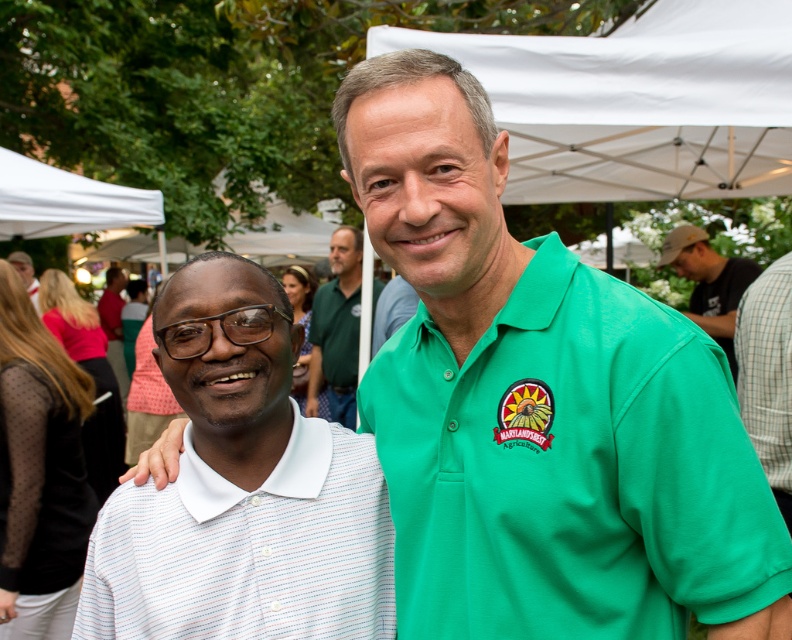
In the scene shown: You are at the community event and want to walk from point A to point B. If point A is at coordinates point (728, 435) and point B is at coordinates point (10, 209), which direction should you move relative to the other point?

To move from point A at coordinates point (728, 435) to point B at coordinates point (10, 209), you should move towards the lower left direction since point A is in front of point B.

You are at an outdoor event and want to find shade. There is a white fabric canopy at upper center marked by point [638,102]. Can you tell me the coordinates of the canopy to locate it?

The white fabric canopy at upper center is located at coordinates [638,102].